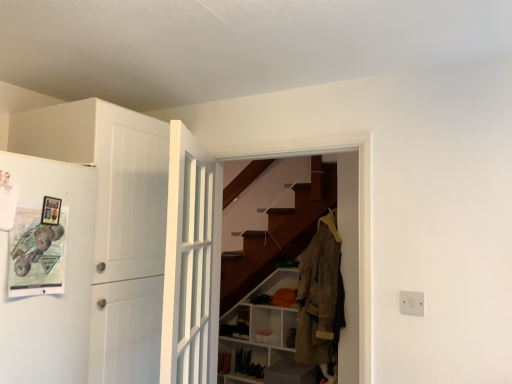
Question: From a real-world perspective, is white plastic switch at lower right physically above white matte door at left, which is counted as the 1th door, starting from the left?

Choices:
 (A) no
 (B) yes

Answer: (A)

Question: From the image's perspective, is white plastic switch at lower right under white matte door at left, which is counted as the 1th door, starting from the left?

Choices:
 (A) yes
 (B) no

Answer: (A)

Question: From a real-world perspective, is white plastic switch at lower right beneath white matte door at left, marked as the second door in a right-to-left arrangement?

Choices:
 (A) yes
 (B) no

Answer: (A)

Question: Does white plastic switch at lower right appear on the right side of white matte door at left, which is counted as the 1th door, starting from the left?

Choices:
 (A) no
 (B) yes

Answer: (B)

Question: Is white plastic switch at lower right looking in the opposite direction of white matte door at left, which is counted as the 1th door, starting from the left?

Choices:
 (A) no
 (B) yes

Answer: (A)

Question: Is white matte door at left, which is counted as the 1th door, starting from the left, inside or outside of white glossy door at center, the 2th door from the left?

Choices:
 (A) inside
 (B) outside

Answer: (B)

Question: Does point [144, 317] appear closer or farther from the camera than point [202, 185]?

Choices:
 (A) farther
 (B) closer

Answer: (B)

Question: Is white matte door at left, which is counted as the 1th door, starting from the left, wider or thinner than white glossy door at center, marked as the 1th door in a right-to-left arrangement?

Choices:
 (A) thin
 (B) wide

Answer: (B)

Question: Is white matte door at left, marked as the second door in a right-to-left arrangement, taller or shorter than white glossy door at center, marked as the 1th door in a right-to-left arrangement?

Choices:
 (A) tall
 (B) short

Answer: (A)

Question: Choose the correct answer: Is white matte door at left, marked as the second door in a right-to-left arrangement, inside tan suede jacket at center or outside it?

Choices:
 (A) outside
 (B) inside

Answer: (A)

Question: Would you say white matte door at left, marked as the second door in a right-to-left arrangement, is to the left or to the right of tan suede jacket at center in the picture?

Choices:
 (A) left
 (B) right

Answer: (A)

Question: From a real-world perspective, is white matte door at left, marked as the second door in a right-to-left arrangement, positioned above or below tan suede jacket at center?

Choices:
 (A) below
 (B) above

Answer: (B)

Question: Based on their sizes in the image, would you say white matte door at left, marked as the second door in a right-to-left arrangement, is bigger or smaller than tan suede jacket at center?

Choices:
 (A) big
 (B) small

Answer: (A)

Question: From a real-world perspective, is white matte cabinet at lower center physically located above or below tan suede jacket at center?

Choices:
 (A) above
 (B) below

Answer: (B)

Question: Considering the positions of point (243, 340) and point (334, 294), is point (243, 340) closer or farther from the camera than point (334, 294)?

Choices:
 (A) closer
 (B) farther

Answer: (B)